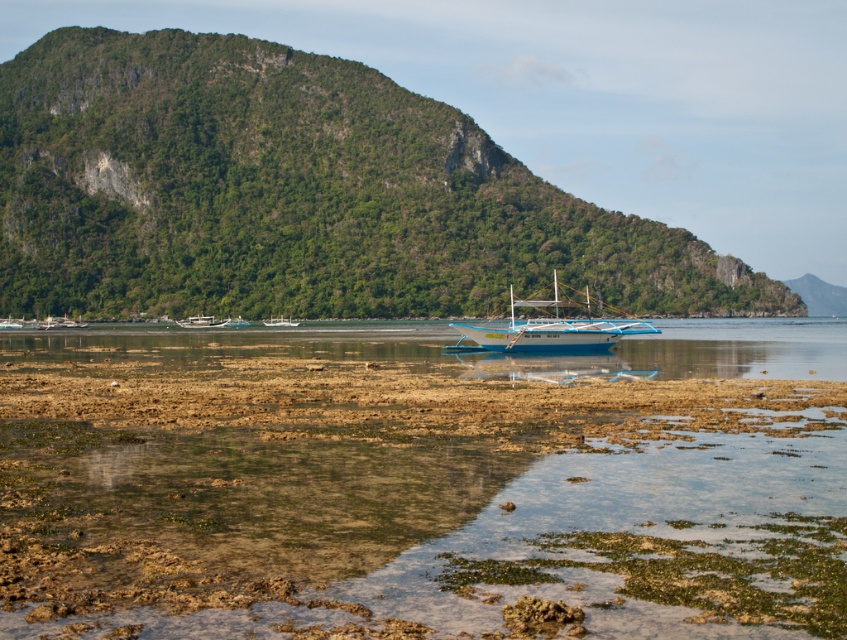
Which of these two, green leafy mountain at right or white glossy boat at center, stands shorter?

white glossy boat at center is shorter.

Does green leafy mountain at right appear over white glossy boat at center?

Yes, green leafy mountain at right is above white glossy boat at center.

Between point (796, 282) and point (289, 323), which one is positioned in front?

Point (289, 323) is more forward.

Image resolution: width=847 pixels, height=640 pixels. Identify the location of green leafy mountain at right. (818, 296).

Measure the distance between point (551, 307) and camera.

The distance of point (551, 307) from camera is 246.22 feet.

Between blue polished wood boat at center and green leafy mountain at right, which one is positioned higher?

green leafy mountain at right is above.

Does point (610, 346) come in front of point (818, 294)?

Yes.

The image size is (847, 640). I want to click on blue polished wood boat at center, so click(554, 326).

Can you confirm if blue polished wood boat at center is positioned to the left of white glossy boat at center?

In fact, blue polished wood boat at center is to the right of white glossy boat at center.

Does point (522, 324) lie in front of point (296, 324)?

Yes, it is in front of point (296, 324).

Which is in front, point (567, 348) or point (294, 323)?

Positioned in front is point (567, 348).

Find the location of a particular element. Image resolution: width=847 pixels, height=640 pixels. blue polished wood boat at center is located at coordinates (554, 326).